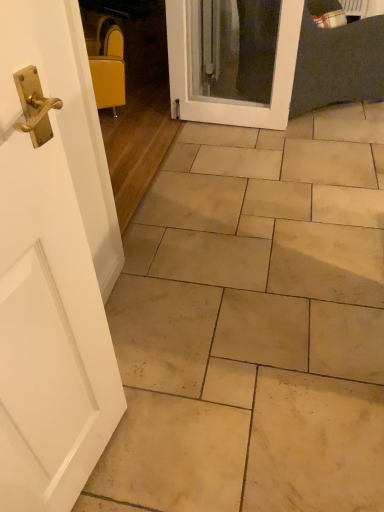
Question: In the image, is white glossy door at center positioned in front of or behind beige stone tile at center?

Choices:
 (A) behind
 (B) front

Answer: (A)

Question: Looking at the image, does white glossy door at center seem bigger or smaller compared to beige stone tile at center?

Choices:
 (A) big
 (B) small

Answer: (B)

Question: Which of these objects is positioned closest to the white glossy door at center?

Choices:
 (A) yellow fabric chair at upper left
 (B) beige stone tile at center

Answer: (A)

Question: Which is farther from the beige stone tile at center?

Choices:
 (A) yellow fabric chair at upper left
 (B) white glossy door at center

Answer: (A)